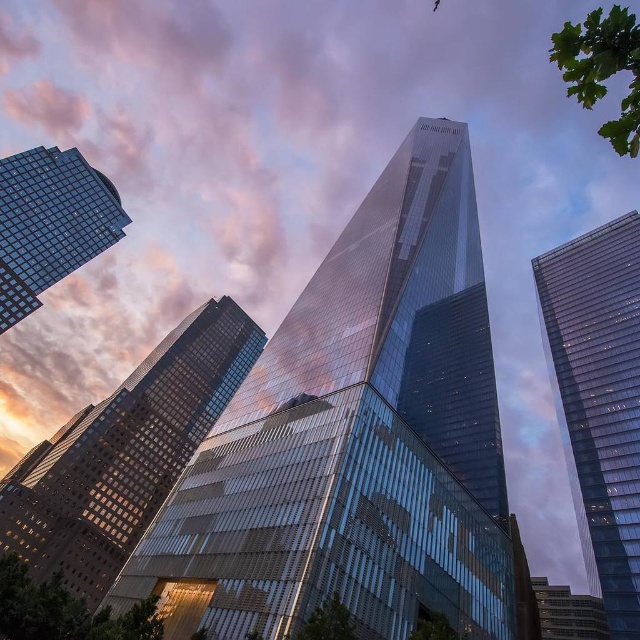
You are an architect analyzing the structural integrity of the transparent glass skyscraper at center and the glassy reflective skyscraper at lower right. Based on their widths, which one might be more stable against strong winds?

The glassy reflective skyscraper at lower right is wider than the transparent glass skyscraper at center, so it might be more stable against strong winds due to its greater width providing better resistance.

You are a drone operator tasked with flying a drone between two glassy reflective skyscrapers. The drone has a maximum flight distance of 50 meters. Given the scene described, can the drone safely fly between the glassy reflective skyscraper at center and the glassy reflective skyscraper at upper left without exceeding its maximum flight distance?

The glassy reflective skyscraper at center and glassy reflective skyscraper at upper left are 47.45 meters apart from each other. Since the drone has a maximum flight distance of 50 meters, it can safely fly between them as the distance is within the drone operator limits.